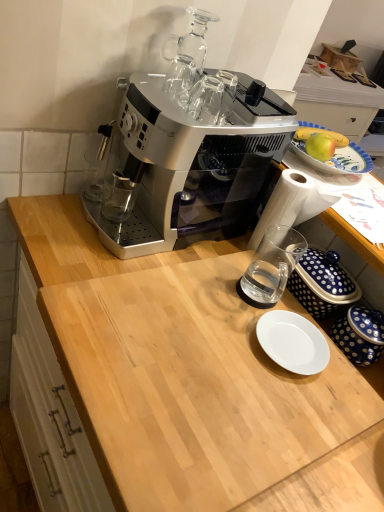
The height and width of the screenshot is (512, 384). I want to click on vacant area that lies to the right of white glossy plate at center, so click(x=349, y=381).